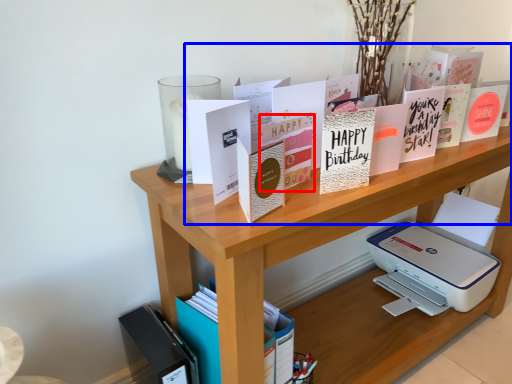
Question: Among these objects, which one is farthest to the camera, paperback book (highlighted by a red box) or book (highlighted by a blue box)?

Choices:
 (A) paperback book
 (B) book

Answer: (A)